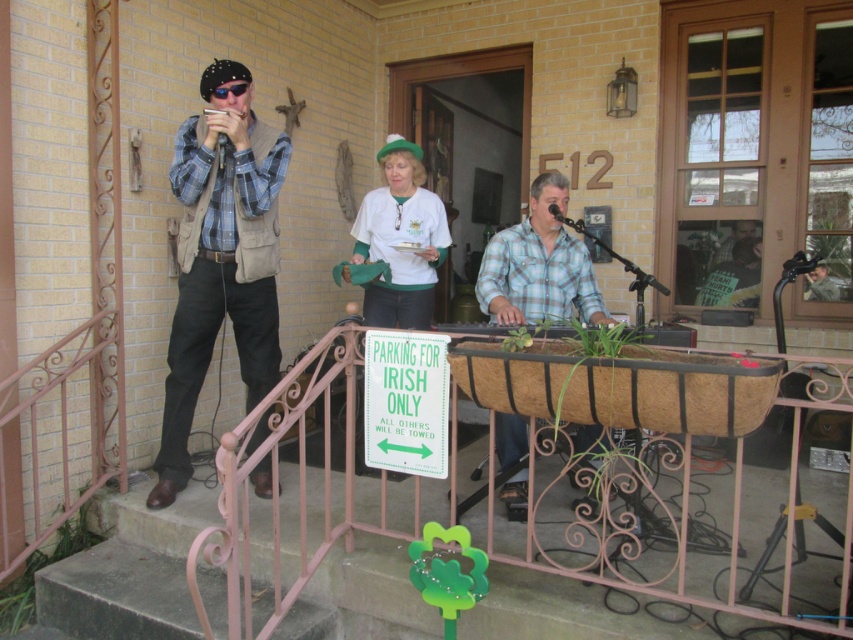
Measure the distance from metallic pink railing at lower center to blue plaid shirt at center.

metallic pink railing at lower center is 3.30 feet away from blue plaid shirt at center.

Which of these two, metallic pink railing at lower center or blue plaid shirt at center, stands taller?

Standing taller between the two is metallic pink railing at lower center.

Measure the distance between point (723, 573) and camera.

8.89 feet

Where is `metallic pink railing at lower center`? metallic pink railing at lower center is located at coordinates (262, 538).

Is the position of white fabric hat at center more distant than that of green plastic sign at center?

Yes, it is.

Which is above, white fabric hat at center or green plastic sign at center?

Positioned higher is white fabric hat at center.

Is point (386, 292) closer to camera compared to point (392, 348)?

No.

Find the location of `white fabric hat at center`. white fabric hat at center is located at coordinates (399, 237).

Is matte brown vest at left thinner than blue plaid shirt at center?

Incorrect, matte brown vest at left's width is not less than blue plaid shirt at center's.

This screenshot has width=853, height=640. Find the location of `matte brown vest at left`. matte brown vest at left is located at coordinates (221, 257).